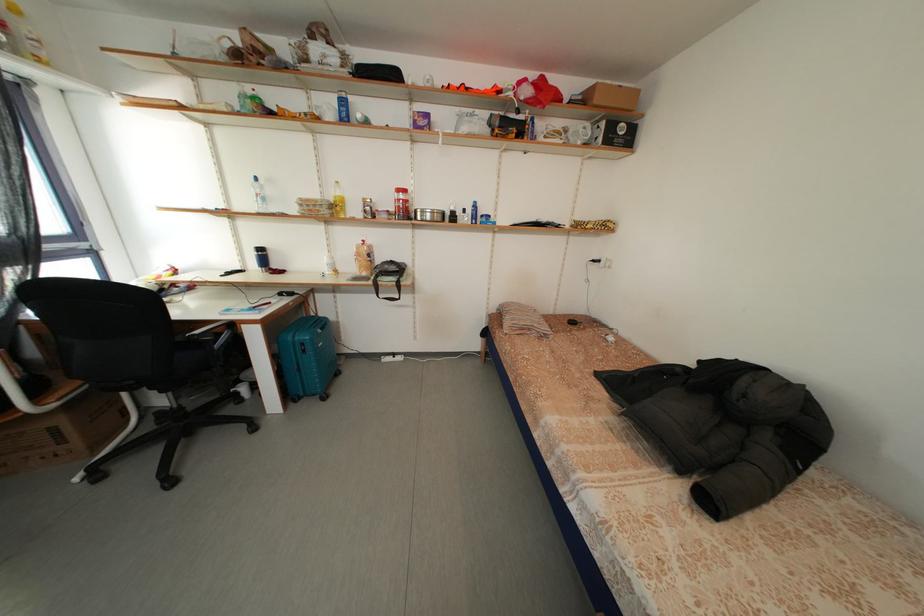
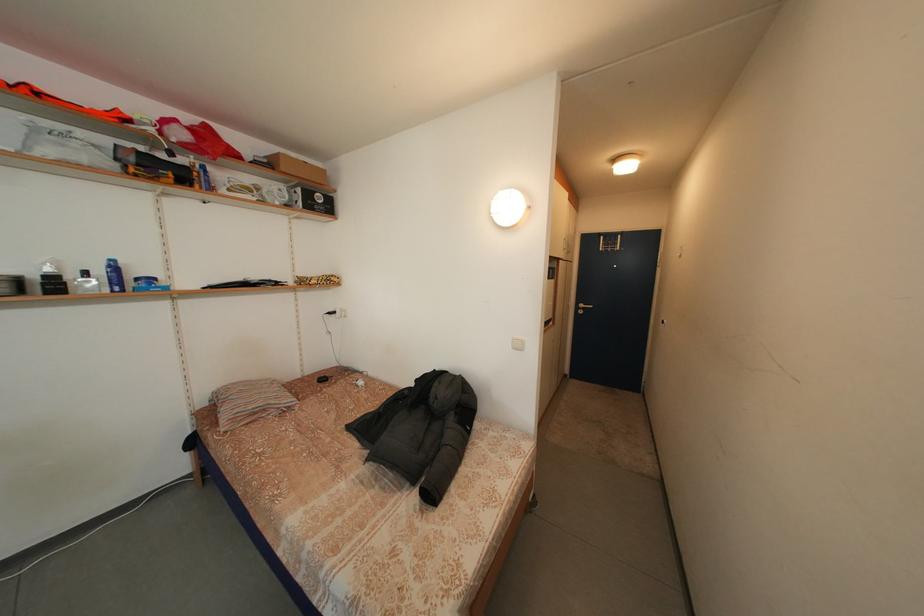
In the second image, find the point that corresponds to (604,105) in the first image.

(292, 175)